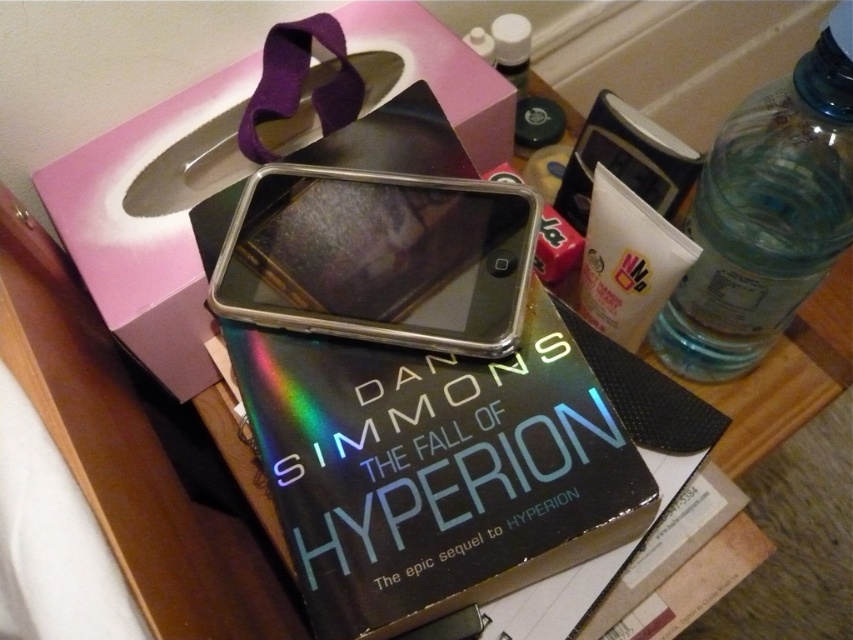
You are organizing items on a cluttered desk. You need to place a holographic hardcover book at center and a clear plastic phone at center. According to the scene description, which item is positioned to the right of the other?

A: The holographic hardcover book at center is to the right of the clear plastic phone at center.

You have a small toy car that is 3 inches long. You want to place it between the holographic hardcover book at center and the clear plastic bottle at right on the cluttered surface. Will the toy car fit in the space between them?

The holographic hardcover book at center is 8.79 inches away from the clear plastic bottle at right. Since the toy car is only 3 inches long, there is enough space between the two objects for it to fit comfortably.

You are organizing items on a desk and want to place the clear plastic phone at center and the clear plastic bottle at right. According to the spatial arrangement shown in the image, which item is located above the other?

The clear plastic bottle at right is located above the clear plastic phone at center because the phone is positioned under the bottle.